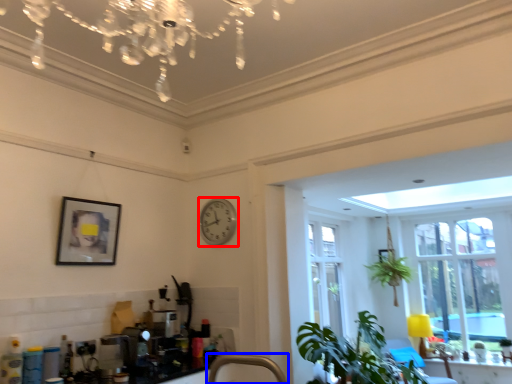
Question: Which object appears closest to the camera in this image, clock (highlighted by a red box) or faucet (highlighted by a blue box)?

Choices:
 (A) clock
 (B) faucet

Answer: (B)